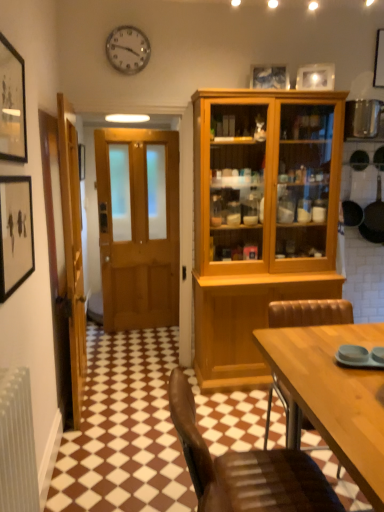
Question: Does matte wooden picture frame at upper center, the 2th picture frame from the back, touch white glossy picture frame at upper center, which is the fourth picture frame from front to back?

Choices:
 (A) yes
 (B) no

Answer: (B)

Question: Is matte wooden picture frame at upper center, placed as the 1th picture frame when sorted from top to bottom, outside of white glossy picture frame at upper center, the third picture frame when ordered from bottom to top?

Choices:
 (A) no
 (B) yes

Answer: (B)

Question: Could you tell me if matte wooden picture frame at upper center, marked as the third picture frame in a front-to-back arrangement, is turned towards white glossy picture frame at upper center, which is counted as the 1th picture frame, starting from the back?

Choices:
 (A) yes
 (B) no

Answer: (B)

Question: Considering the relative sizes of matte wooden picture frame at upper center, which is the fourth picture frame from bottom to top, and white glossy picture frame at upper center, the second picture frame positioned from the top, in the image provided, is matte wooden picture frame at upper center, which is the fourth picture frame from bottom to top, wider than white glossy picture frame at upper center, the second picture frame positioned from the top,?

Choices:
 (A) no
 (B) yes

Answer: (B)

Question: Are matte wooden picture frame at upper center, marked as the third picture frame in a front-to-back arrangement, and white glossy picture frame at upper center, positioned as the first picture frame in right-to-left order, located far from each other?

Choices:
 (A) no
 (B) yes

Answer: (A)

Question: Considering the relative sizes of matte wooden picture frame at upper center, positioned as the third picture frame in left-to-right order, and white glossy picture frame at upper center, which is the fourth picture frame from front to back, in the image provided, is matte wooden picture frame at upper center, positioned as the third picture frame in left-to-right order, smaller than white glossy picture frame at upper center, which is the fourth picture frame from front to back,?

Choices:
 (A) no
 (B) yes

Answer: (A)

Question: Does matte black picture frame at left, positioned as the 1th picture frame in bottom-to-top order, have a greater height compared to white glossy picture frame at upper center, which is counted as the 1th picture frame, starting from the back?

Choices:
 (A) yes
 (B) no

Answer: (A)

Question: Considering the relative sizes of matte black picture frame at left, the 4th picture frame positioned from the right, and white glossy picture frame at upper center, which is the 4th picture frame in left-to-right order, in the image provided, is matte black picture frame at left, the 4th picture frame positioned from the right, bigger than white glossy picture frame at upper center, which is the 4th picture frame in left-to-right order,?

Choices:
 (A) no
 (B) yes

Answer: (B)

Question: Would you say matte black picture frame at left, marked as the 2th picture frame in a front-to-back arrangement, is a long distance from white glossy picture frame at upper center, the third picture frame when ordered from bottom to top?

Choices:
 (A) no
 (B) yes

Answer: (B)

Question: Could you tell me if matte black picture frame at left, marked as the 2th picture frame in a front-to-back arrangement, is facing white glossy picture frame at upper center, the second picture frame positioned from the top?

Choices:
 (A) no
 (B) yes

Answer: (A)

Question: Considering the relative positions of matte black picture frame at left, which ranks as the 4th picture frame in top-to-bottom order, and white glossy picture frame at upper center, which is the 4th picture frame in left-to-right order, in the image provided, is matte black picture frame at left, which ranks as the 4th picture frame in top-to-bottom order, to the left of white glossy picture frame at upper center, which is the 4th picture frame in left-to-right order, from the viewer's perspective?

Choices:
 (A) no
 (B) yes

Answer: (B)

Question: Does matte black picture frame at left, the 1th picture frame positioned from the left, come behind white glossy picture frame at upper center, which is the fourth picture frame from front to back?

Choices:
 (A) yes
 (B) no

Answer: (B)

Question: Is white glossy picture frame at upper center, the third picture frame when ordered from bottom to top, to the right of black non-stick frying pan at right from the viewer's perspective?

Choices:
 (A) no
 (B) yes

Answer: (A)